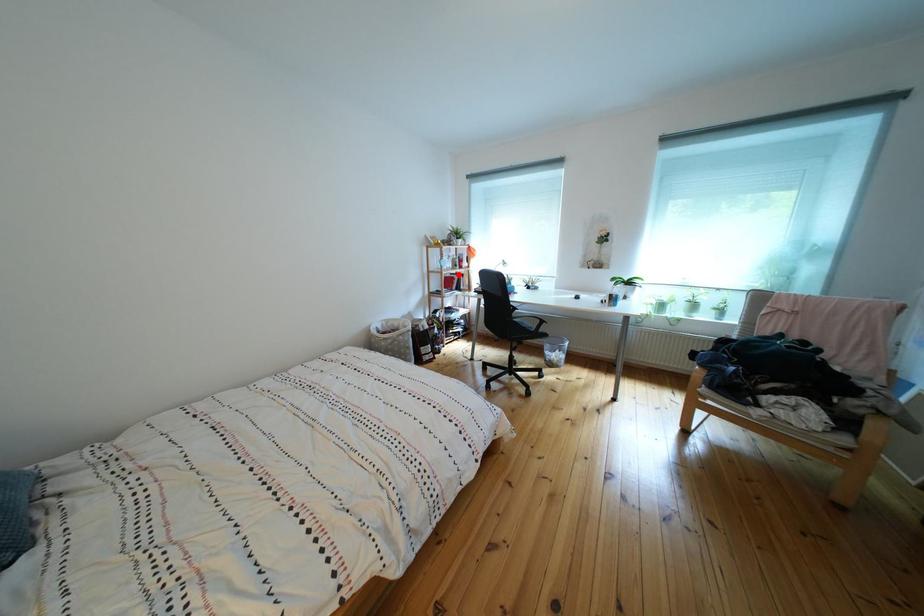
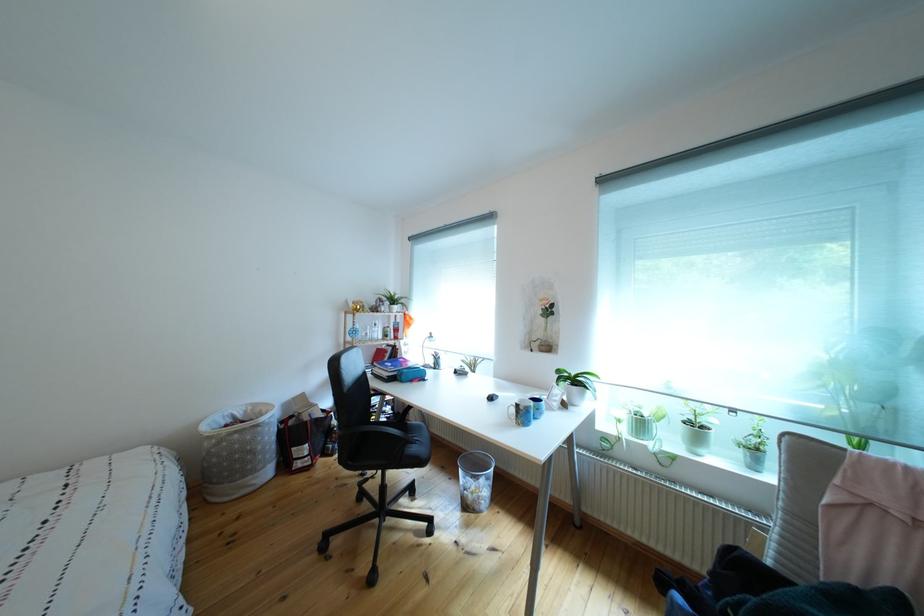
Question: A red point is marked in image1. In image2, is the corresponding 3D point closer to the camera or farther? Reply with the corresponding letter.

Choices:
 (A) The corresponding 3D point is closer.
 (B) The corresponding 3D point is farther.

Answer: (B)